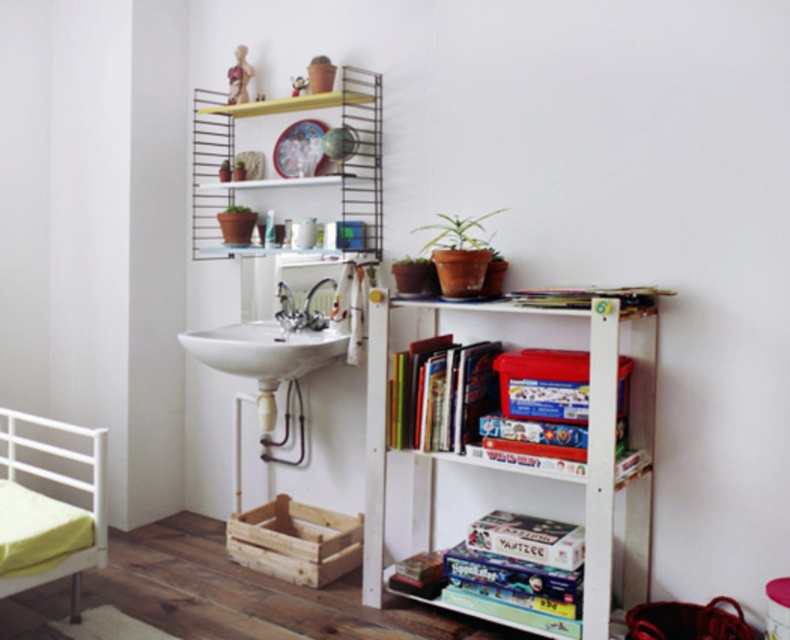
In the scene shown: Is white metal bed at lower left below hardcover books at center?

Yes, white metal bed at lower left is below hardcover books at center.

Where is `white metal bed at lower left`? white metal bed at lower left is located at coordinates (47, 509).

I want to click on white metal bed at lower left, so click(x=47, y=509).

Can you confirm if white glossy sink at center is positioned above silver metallic faucet at center?

Incorrect, white glossy sink at center is not positioned above silver metallic faucet at center.

Which of these two, white glossy sink at center or silver metallic faucet at center, stands shorter?

Standing shorter between the two is silver metallic faucet at center.

Who is more forward, (213,348) or (286,310)?

Point (213,348)

You are a GUI agent. You are given a task and a screenshot of the screen. Output one action in this format:
    pyautogui.click(x=<x>, y=<y>)
    Task: Click on the white glossy sink at center
    This screenshot has height=640, width=790.
    Given the screenshot: What is the action you would take?
    pyautogui.click(x=264, y=349)

Between white metal bed at lower left and brown terracotta pot at center, which one appears on the left side from the viewer's perspective?

From the viewer's perspective, white metal bed at lower left appears more on the left side.

Who is more forward, (81, 561) or (461, 221)?

Point (81, 561)

Locate an element on the screen. This screenshot has height=640, width=790. white metal bed at lower left is located at coordinates (47, 509).